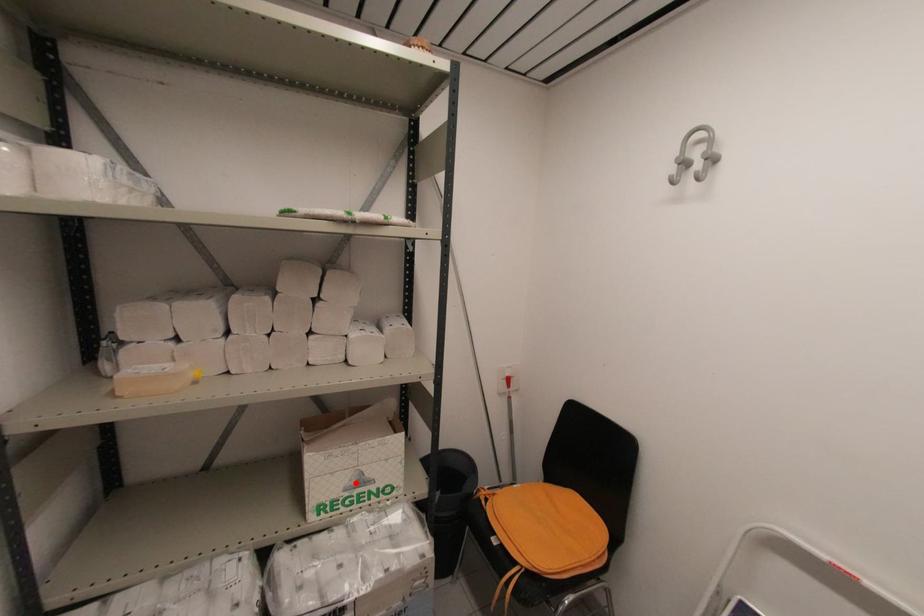
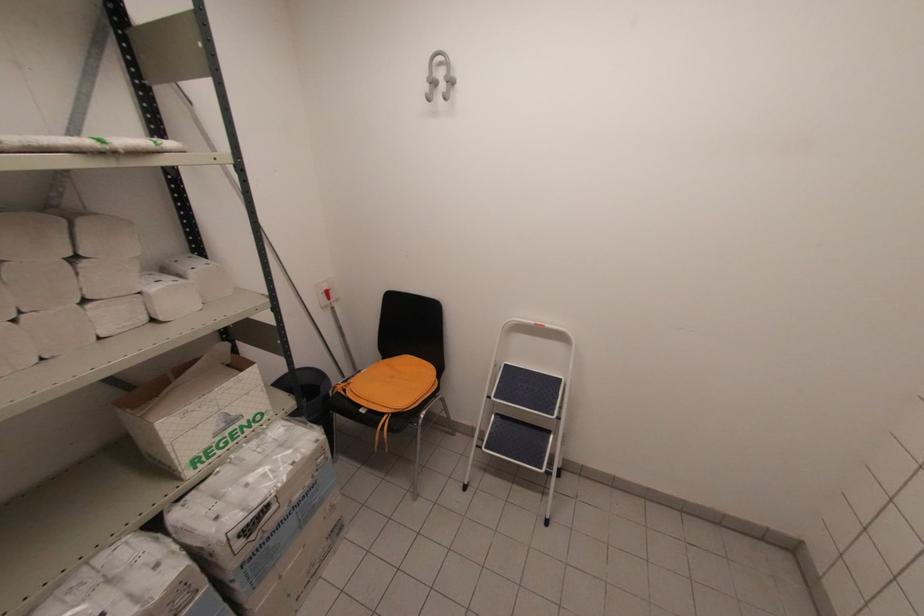
The point at the highlighted location is marked in the first image. Where is the corresponding point in the second image?

(224, 426)